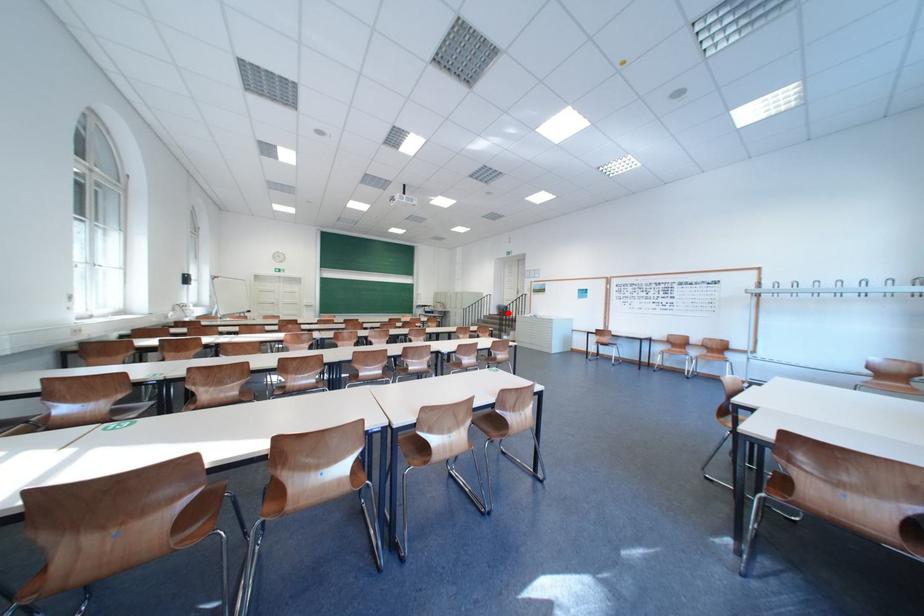
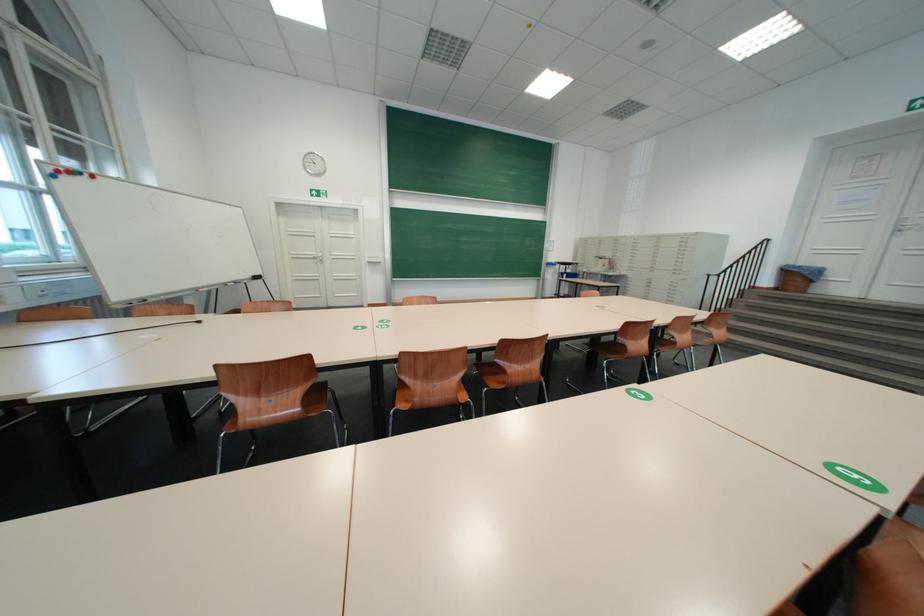
Question: I am providing you with two images of the same scene from different viewpoints. A red point is marked on the first image. Is the red point's position out of view in image 2?

Choices:
 (A) Yes
 (B) No

Answer: (B)